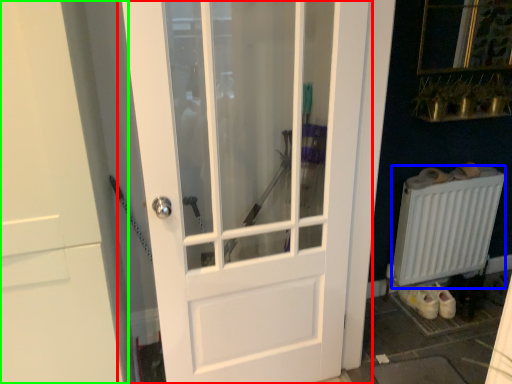
Question: Which is farther away from door (highlighted by a red box)? radiator (highlighted by a blue box) or door (highlighted by a green box)?

Choices:
 (A) radiator
 (B) door

Answer: (A)